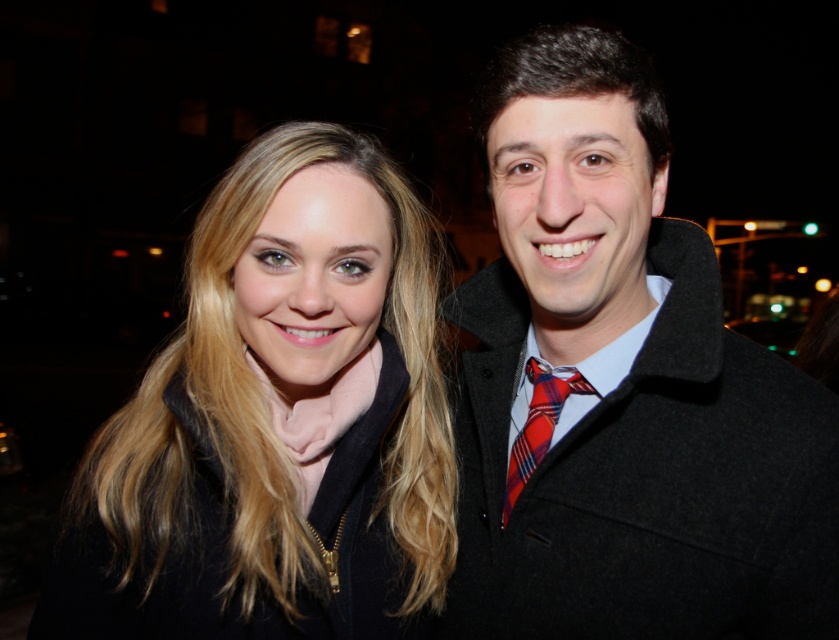
Question: Is matte black coat at right to the right of matte black coat at center from the viewer's perspective?

Choices:
 (A) no
 (B) yes

Answer: (B)

Question: Which point is farther to the camera?

Choices:
 (A) (527, 474)
 (B) (473, 540)

Answer: (B)

Question: Which point is farther from the camera taking this photo?

Choices:
 (A) (225, 240)
 (B) (519, 451)
 (C) (582, 218)

Answer: (B)

Question: Estimate the real-world distances between objects in this image. Which object is closer to the matte black coat at center?

Choices:
 (A) plaid fabric tie at right
 (B) matte black coat at right

Answer: (B)

Question: Is matte black coat at center closer to the viewer compared to plaid fabric tie at right?

Choices:
 (A) no
 (B) yes

Answer: (B)

Question: Is matte black coat at center positioned in front of plaid fabric tie at right?

Choices:
 (A) no
 (B) yes

Answer: (B)